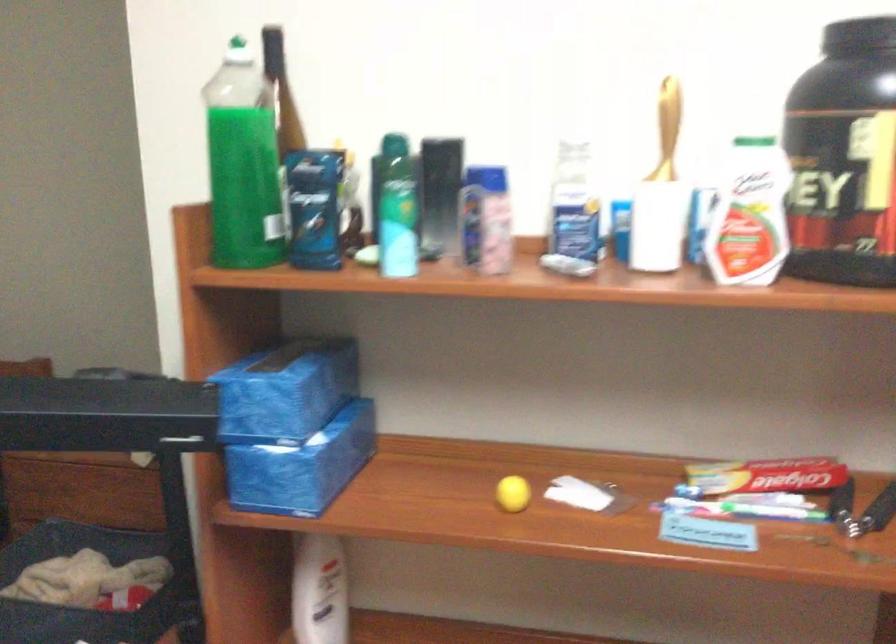
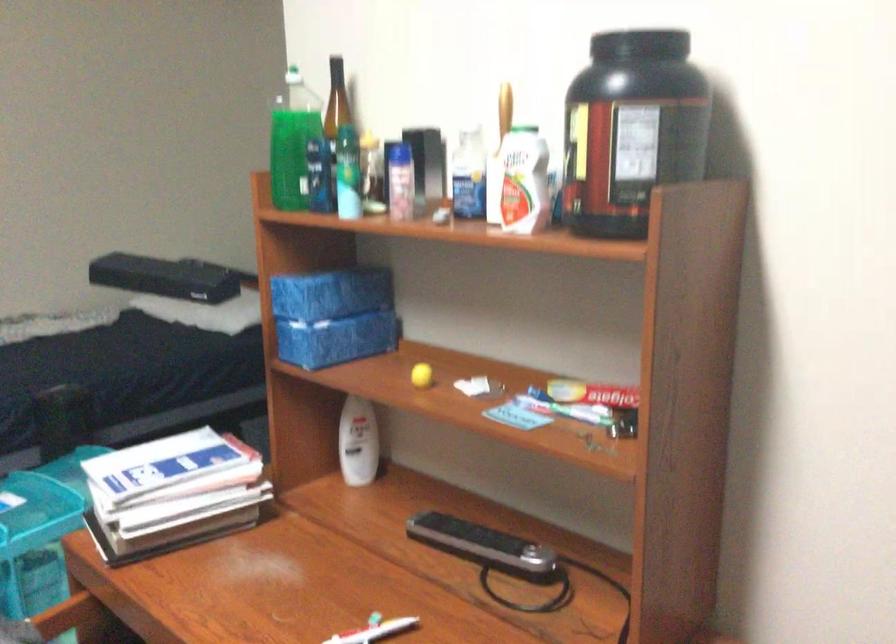
Question: The first image is from the beginning of the video and the second image is from the end. How did the camera likely rotate when shooting the video?

Choices:
 (A) Left
 (B) Right
 (C) Up
 (D) Down

Answer: (A)